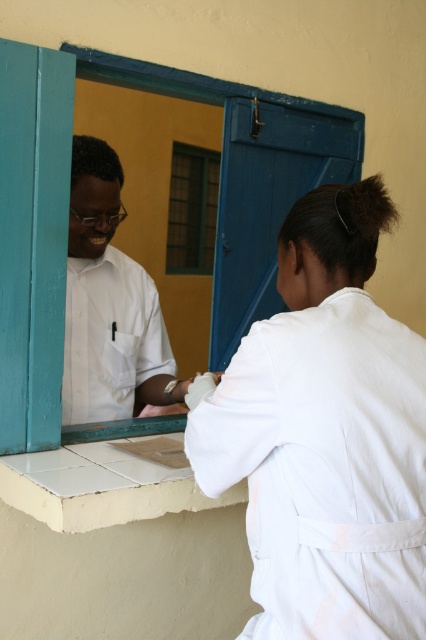
Who is shorter, white shirt at left or yellow matte window at center?

With less height is yellow matte window at center.

Looking at this image, does white shirt at left lie behind yellow matte window at center?

No, it is not.

Identify the location of white shirt at left. (109, 307).

This screenshot has width=426, height=640. Find the location of `white shirt at left`. white shirt at left is located at coordinates (109, 307).

Who is taller, white cloth at right or teal wood window frame at upper center?

teal wood window frame at upper center

Who is more forward, (334, 214) or (215, 349)?

Positioned in front is point (334, 214).

Where is `white cloth at right`? The image size is (426, 640). white cloth at right is located at coordinates (325, 435).

From the picture: Is teal wood window frame at upper center wider than yellow matte window at center?

Yes, teal wood window frame at upper center is wider than yellow matte window at center.

Is teal wood window frame at upper center to the left of yellow matte window at center from the viewer's perspective?

In fact, teal wood window frame at upper center is to the right of yellow matte window at center.

In the scene shown: Who is more distant from viewer, (244,198) or (183,218)?

The point (183,218) is more distant.

Where is `teal wood window frame at upper center`? The height and width of the screenshot is (640, 426). teal wood window frame at upper center is located at coordinates (32, 240).